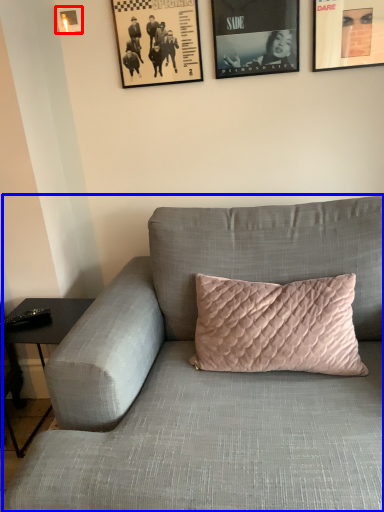
Question: Which point is further to the camera, picture frame (highlighted by a red box) or studio couch (highlighted by a blue box)?

Choices:
 (A) picture frame
 (B) studio couch

Answer: (A)